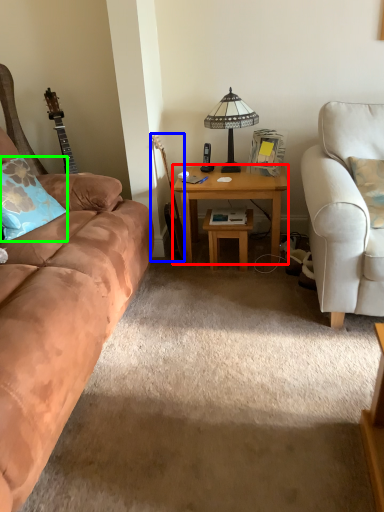
Question: Considering the real-world distances, which object is closest to desk (highlighted by a red box)? guitar (highlighted by a blue box) or pillow (highlighted by a green box).

Choices:
 (A) guitar
 (B) pillow

Answer: (A)